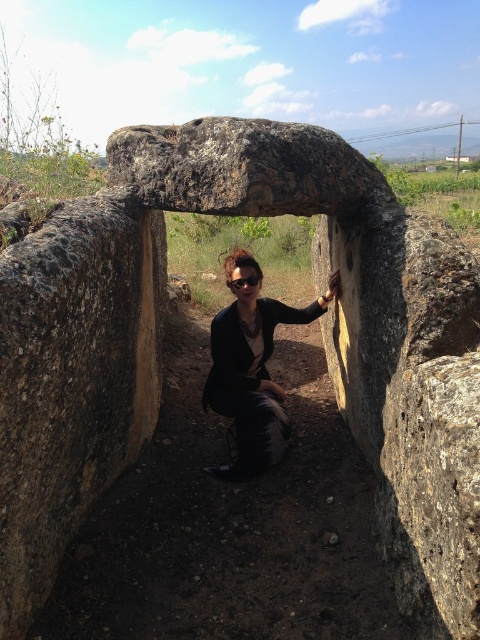
Is matte black jacket at center shorter than black matte goggles at center?

No, matte black jacket at center is not shorter than black matte goggles at center.

Is matte black jacket at center bigger than black matte goggles at center?

Yes.

Does point (266, 301) come in front of point (245, 284)?

No, (266, 301) is further to viewer.

This screenshot has width=480, height=640. I want to click on matte black jacket at center, so click(x=252, y=376).